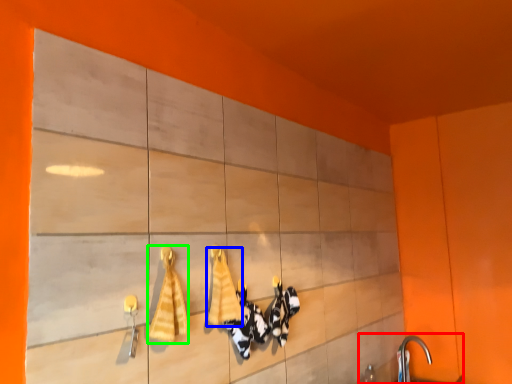
Question: Which object is positioned closest to sink (highlighted by a red box)? Select from bath towel (highlighted by a blue box) and bath towel (highlighted by a green box).

Choices:
 (A) bath towel
 (B) bath towel

Answer: (A)